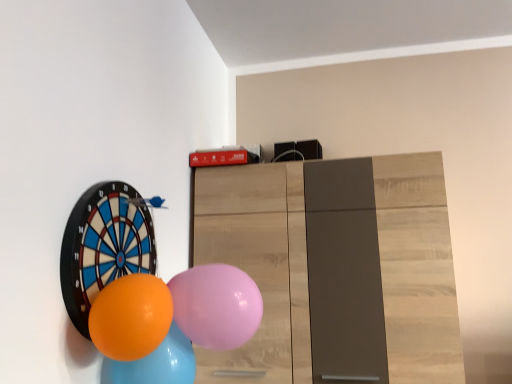
Question: Would you say orange rubber balloon at left, the fourth balloon from the right, is inside or outside orange glossy balloon at lower left, which is the 2th balloon in right-to-left order?

Choices:
 (A) outside
 (B) inside

Answer: (A)

Question: Considering the positions of orange rubber balloon at left, the fourth balloon from the right, and orange glossy balloon at lower left, which is the 2th balloon in right-to-left order, in the image, is orange rubber balloon at left, the fourth balloon from the right, wider or thinner than orange glossy balloon at lower left, which is the 2th balloon in right-to-left order,?

Choices:
 (A) wide
 (B) thin

Answer: (B)

Question: Which is nearer to the pink rubber balloon at center, which is the 1th balloon in right-to-left order?

Choices:
 (A) orange rubber balloon at left, the 1th balloon in the left-to-right sequence
 (B) orange glossy balloon at lower left, arranged as the third balloon when viewed from the right
 (C) orange glossy balloon at lower left, the 3th balloon viewed from the left

Answer: (B)

Question: Which object is positioned closest to the orange rubber balloon at left, the fourth balloon from the right?

Choices:
 (A) pink rubber balloon at center, the fourth balloon viewed from the left
 (B) orange glossy balloon at lower left, which is the 2th balloon in right-to-left order
 (C) orange glossy balloon at lower left, arranged as the third balloon when viewed from the right

Answer: (B)